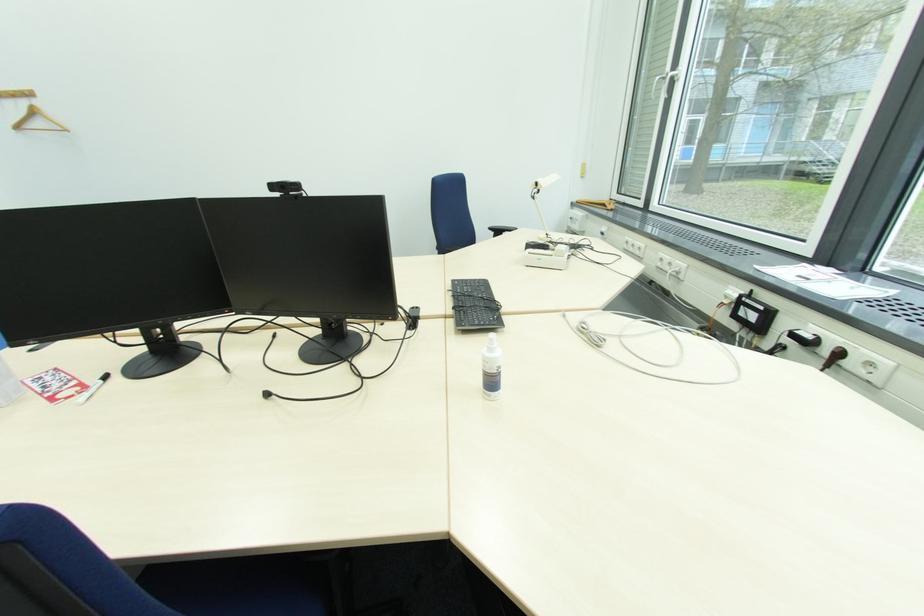
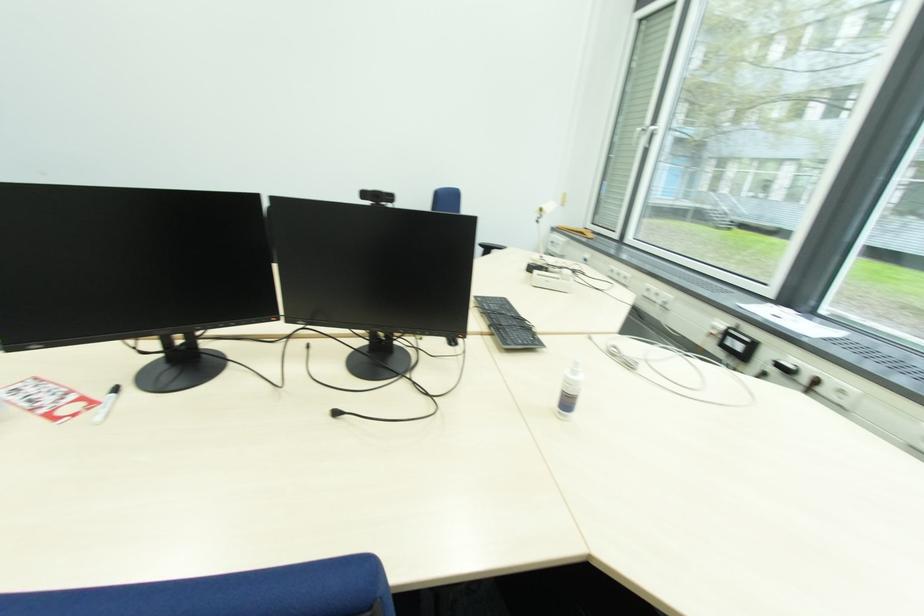
Question: I am providing you with two images of the same scene from different viewpoints. Which of the following objects are not visible in image2?

Choices:
 (A) white marker
 (B) black keyboard
 (C) black wall switch
 (D) none of these

Answer: (D)